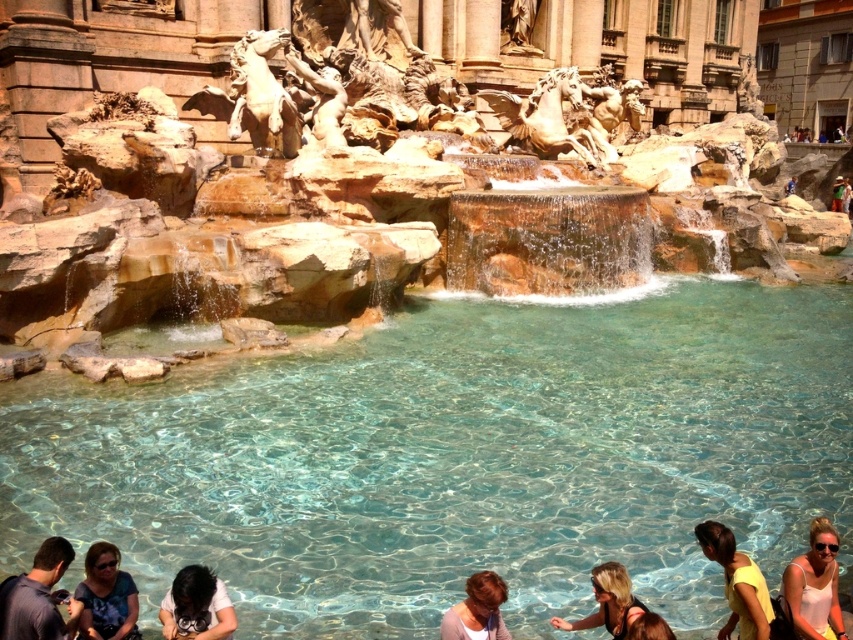
From the picture: You are a tourist visiting the Trevi Fountain and want to take a photo of the brown leather bag at lower center without any people blocking it. Since you see the dark gray shirt at lower left in the scene, can you adjust your position to capture the bag unobstructed?

The brown leather bag at lower center is behind the dark gray shirt at lower left, so you can move to a position where the dark gray shirt at lower left is no longer between you and the bag to take an unobstructed photo.

You are standing at the Trevi Fountain and want to take a photo of the point marked at coordinates point (741, 572). If your camera has a maximum focus range of 25 meters, will you be able to capture it clearly?

The point (741, 572) is 26.90 meters away from the camera. Since the camera can only focus up to 25 meters, it will be out of the camera range and cannot be captured clearly.

You are a photographer aiming to capture the Trevi Fountain with its turquoise basin and surrounding statues. You notice two items in the lower left corner of your frame. Which object is positioned lower in the image between the dark gray shirt at lower left and the matte blue sunglasses at lower left?

The dark gray shirt at lower left is positioned lower than the matte blue sunglasses at lower left because it has a lesser height compared to the sunglasses.